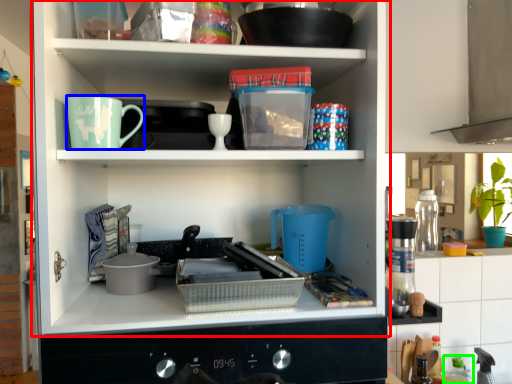
Question: Which is nearer to the shelf (highlighted by a red box)? coffee cup (highlighted by a blue box) or bottle (highlighted by a green box).

Choices:
 (A) coffee cup
 (B) bottle

Answer: (A)